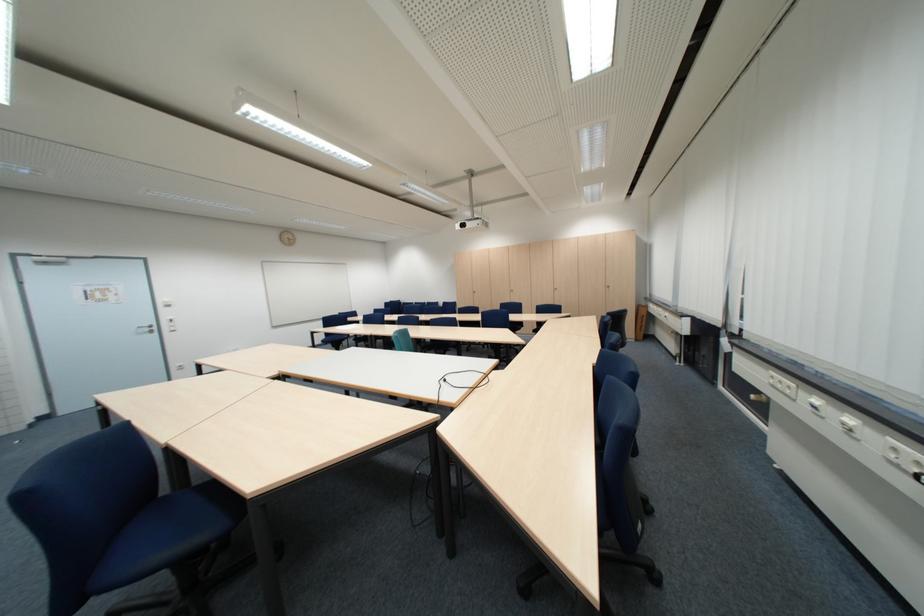
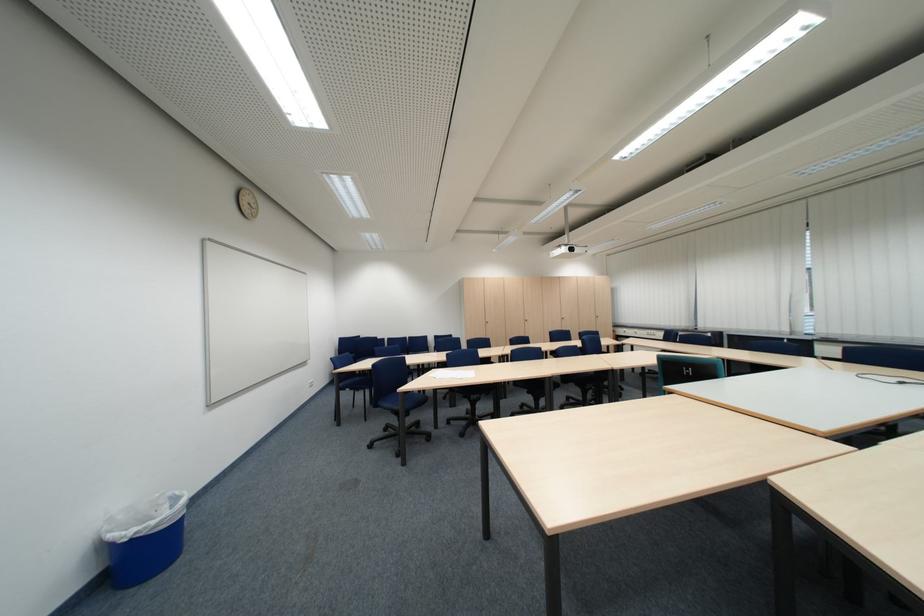
Find the pixel in the second image that matches point 298,240 in the first image.

(257, 204)